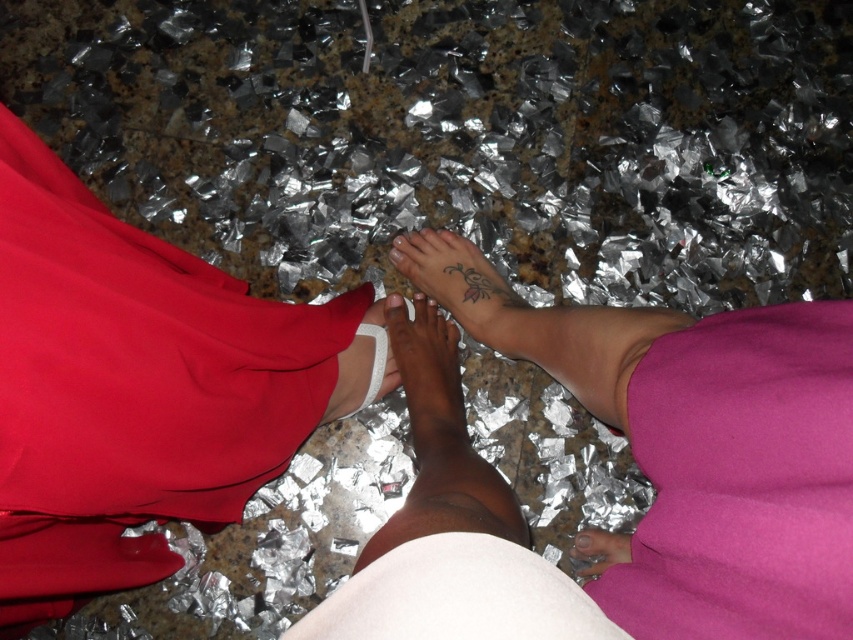
You are organizing a fashion show and need to place the matte red dress at left and the white fabric at center on a runway. Given their widths, which one should be positioned first to ensure they fit side by side without overlapping?

The matte red dress at left is wider than the white fabric at center, so position the white fabric at center first to accommodate the wider dress next to it without overlapping.

Based on the coordinates provided, which object is located at point (741, 480)?

The purple matte dress at lower right is located at point (741, 480).